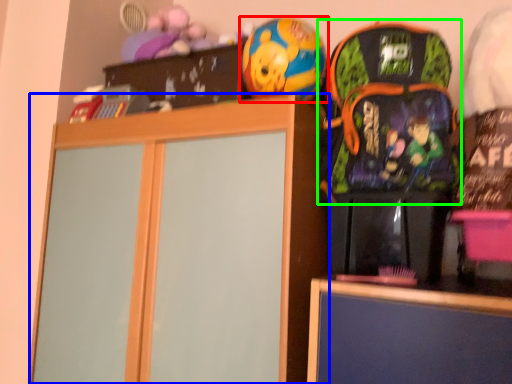
Question: Estimate the real-world distances between objects in this image. Which object is closer to toy (highlighted by a red box), cabinetry (highlighted by a blue box) or backpack (highlighted by a green box)?

Choices:
 (A) cabinetry
 (B) backpack

Answer: (B)